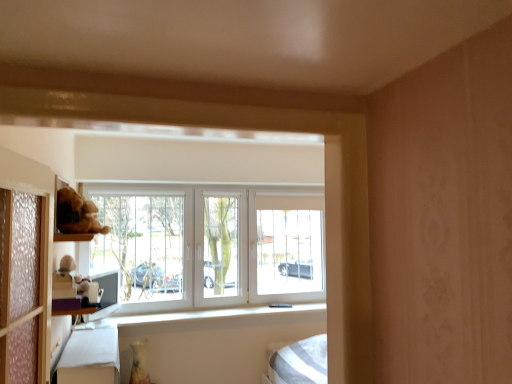
Find the location of `empty space that is ontop of white plastic window at center (from a real-world perspective)`. empty space that is ontop of white plastic window at center (from a real-world perspective) is located at coordinates (194, 183).